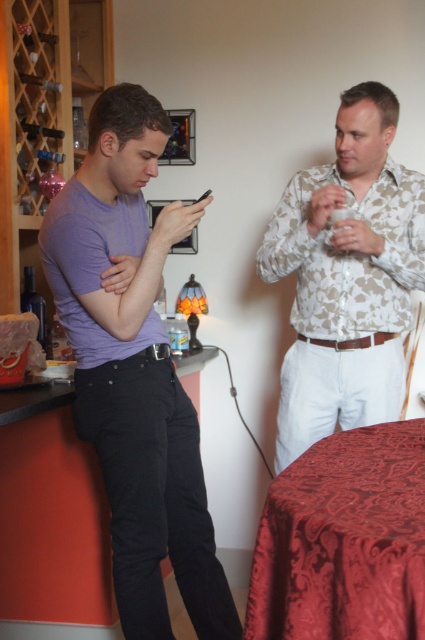
You are standing in the kitchen and want to reach the point marked at coordinates (359, 403). Can you estimate how far you need to walk to get there?

The distance between you and the point marked at coordinates (359, 403) is 6.53 feet, so you need to walk approximately 6.53 feet to reach it.

You are standing in the room and want to reach the point marked as point (195, 477). If your reach extends 1.5 meters, can you touch it without moving your feet?

The distance between you and point (195, 477) is 1.76 meters, which is beyond your 1.5 meter reach. You cannot touch it without moving.